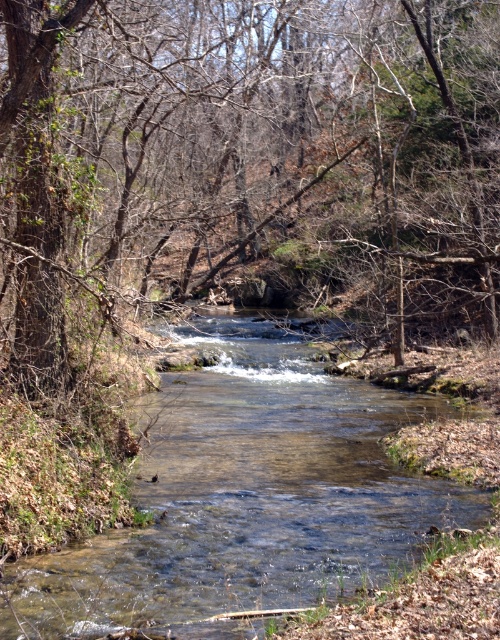
You are standing at the origin point of the image. Which direction should you move to reach the brown wood tree at center?

The brown wood tree at center is located at point coordinates of 0.245 on the x axis and 0.496 on the y axis. Since the origin point is typically the bottom left corner of an image, moving towards the right and slightly upwards would lead to the tree.

You are standing in the woods and want to cross the stream. You see the brown wood tree at center and the clear water at center. Which object is closer to you, and why?

The brown wood tree at center is closer to you because it is positioned further to the viewer than the clear water at center, meaning it appears nearer in the scene.